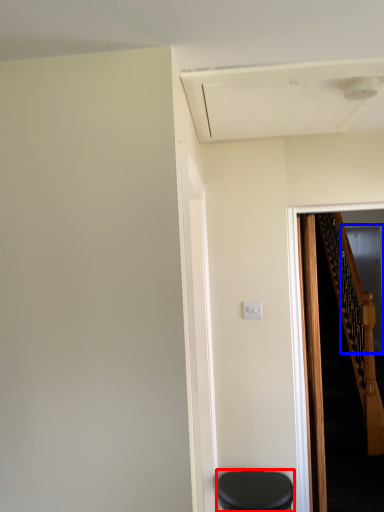
Question: Which object is further to the camera taking this photo, furniture (highlighted by a red box) or glass door (highlighted by a blue box)?

Choices:
 (A) furniture
 (B) glass door

Answer: (B)